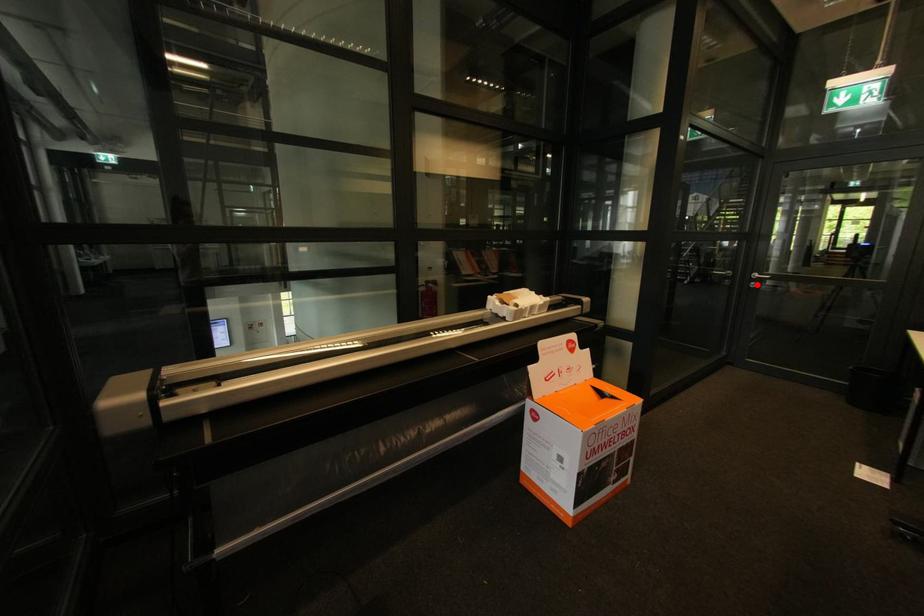
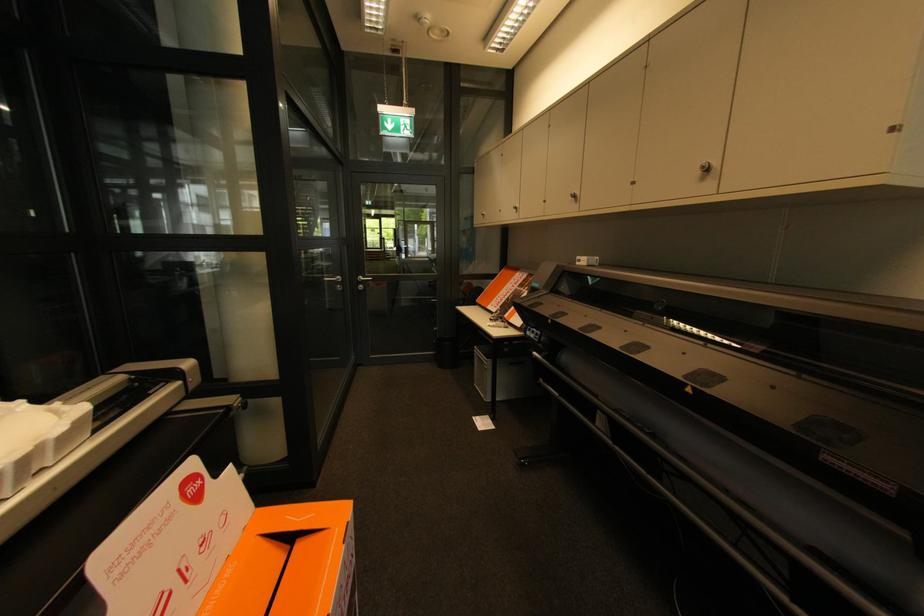
Locate, in the second image, the point that corresponds to the highlighted location in the first image.

(365, 286)